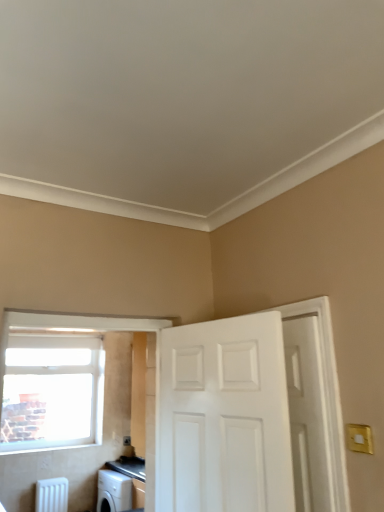
Question: Considering the relative positions of clear glass window at upper left and white glossy door at center, the second door in the right-to-left sequence, in the image provided, is clear glass window at upper left to the left of white glossy door at center, the second door in the right-to-left sequence, from the viewer's perspective?

Choices:
 (A) yes
 (B) no

Answer: (A)

Question: From a real-world perspective, is clear glass window at upper left located beneath white glossy door at center, the second door in the right-to-left sequence?

Choices:
 (A) yes
 (B) no

Answer: (B)

Question: Is clear glass window at upper left positioned behind white glossy door at center, marked as the 1th door in a left-to-right arrangement?

Choices:
 (A) yes
 (B) no

Answer: (A)

Question: From the image's perspective, is clear glass window at upper left located beneath white glossy door at center, marked as the 1th door in a left-to-right arrangement?

Choices:
 (A) no
 (B) yes

Answer: (B)

Question: Is clear glass window at upper left positioned before white glossy door at center, the second door in the right-to-left sequence?

Choices:
 (A) yes
 (B) no

Answer: (B)

Question: Can we say clear glass window at upper left lies outside white glossy door at center, the second door in the right-to-left sequence?

Choices:
 (A) no
 (B) yes

Answer: (B)

Question: Is clear glass window at upper left outside white matte door at right, the 1th door in the right-to-left sequence?

Choices:
 (A) yes
 (B) no

Answer: (A)

Question: Is clear glass window at upper left thinner than white matte door at right, placed as the second door when sorted from left to right?

Choices:
 (A) yes
 (B) no

Answer: (A)

Question: From the image's perspective, is clear glass window at upper left beneath white matte door at right, placed as the second door when sorted from left to right?

Choices:
 (A) yes
 (B) no

Answer: (A)

Question: Is clear glass window at upper left surrounding white matte door at right, the 1th door in the right-to-left sequence?

Choices:
 (A) yes
 (B) no

Answer: (B)

Question: Is clear glass window at upper left with white matte door at right, the 1th door in the right-to-left sequence?

Choices:
 (A) yes
 (B) no

Answer: (B)

Question: Does clear glass window at upper left have a larger size compared to white matte door at right, the 1th door in the right-to-left sequence?

Choices:
 (A) yes
 (B) no

Answer: (A)

Question: Considering the relative sizes of white glossy door at center, the second door in the right-to-left sequence, and clear glass window at upper left in the image provided, is white glossy door at center, the second door in the right-to-left sequence, taller than clear glass window at upper left?

Choices:
 (A) no
 (B) yes

Answer: (A)